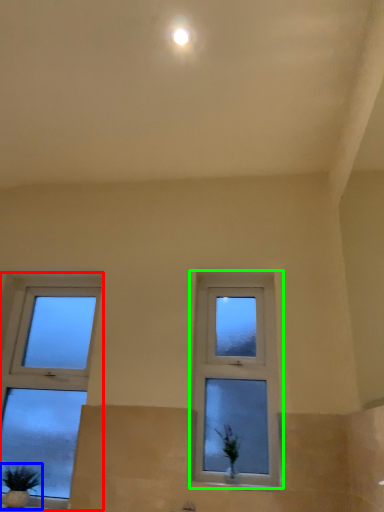
Question: Which object is the closest to the window (highlighted by a red box)? Choose among these: houseplant (highlighted by a blue box) or window (highlighted by a green box).

Choices:
 (A) houseplant
 (B) window

Answer: (A)